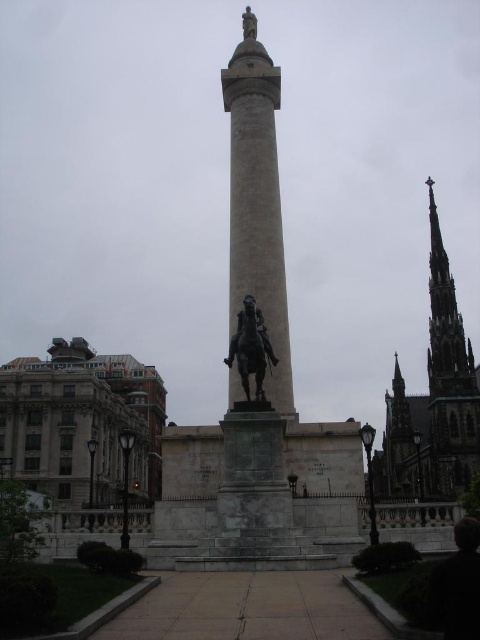
Question: Is dark gray stone spire at right above bronze statue at center?

Choices:
 (A) yes
 (B) no

Answer: (B)

Question: Which point appears closest to the camera in this image?

Choices:
 (A) (436, 371)
 (B) (245, 68)

Answer: (B)

Question: Is white marble column at center positioned at the back of dark gray stone spire at right?

Choices:
 (A) yes
 (B) no

Answer: (B)

Question: Can you confirm if white marble column at center is wider than bronze statue at center?

Choices:
 (A) yes
 (B) no

Answer: (A)

Question: Which object is farther from the camera taking this photo?

Choices:
 (A) white marble column at center
 (B) bronze statue at center
 (C) dark gray stone spire at right

Answer: (C)

Question: Which is nearer to the white marble column at center?

Choices:
 (A) bronze statue at center
 (B) dark gray stone spire at right

Answer: (A)